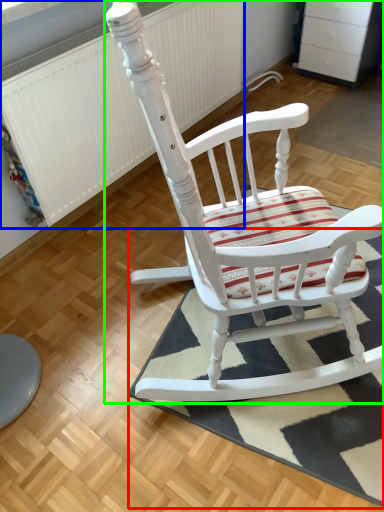
Question: Which is farther away from doormat (highlighted by a red box)? radiator (highlighted by a blue box) or chair (highlighted by a green box)?

Choices:
 (A) radiator
 (B) chair

Answer: (A)